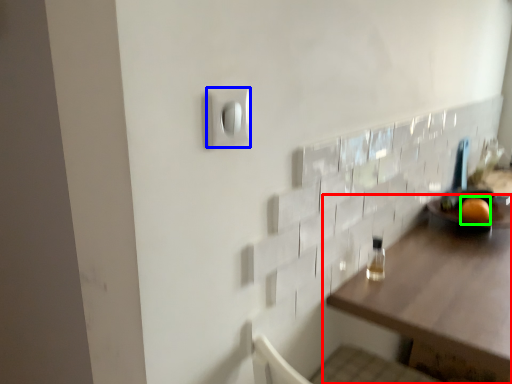
Question: Which object is positioned farthest from table (highlighted by a red box)? Select from light switch (highlighted by a blue box) and orange (highlighted by a green box).

Choices:
 (A) light switch
 (B) orange

Answer: (A)